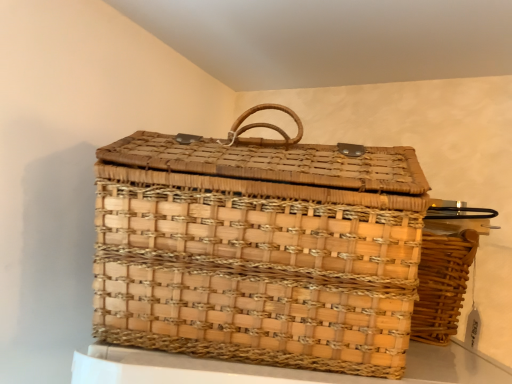
Question: From the image's perspective, is natural woven picnic basket at right, acting as the 1th picnic basket starting from the right, located above or below natural woven picnic basket at center, which appears as the 2th picnic basket when viewed from the right?

Choices:
 (A) above
 (B) below

Answer: (B)

Question: Considering their positions, is natural woven picnic basket at right, acting as the 1th picnic basket starting from the right, located in front of or behind natural woven picnic basket at center, which appears as the 2th picnic basket when viewed from the right?

Choices:
 (A) front
 (B) behind

Answer: (B)

Question: Considering the positions of natural woven picnic basket at right, acting as the 1th picnic basket starting from the right, and natural woven picnic basket at center, which ranks as the 1th picnic basket in left-to-right order, in the image, is natural woven picnic basket at right, acting as the 1th picnic basket starting from the right, taller or shorter than natural woven picnic basket at center, which ranks as the 1th picnic basket in left-to-right order,?

Choices:
 (A) tall
 (B) short

Answer: (B)

Question: From a real-world perspective, is natural woven picnic basket at center, which ranks as the 1th picnic basket in left-to-right order, physically located above or below natural woven picnic basket at right, which appears as the 2th picnic basket when viewed from the left?

Choices:
 (A) above
 (B) below

Answer: (A)

Question: From the image's perspective, is natural woven picnic basket at center, which ranks as the 1th picnic basket in left-to-right order, located above or below natural woven picnic basket at right, which appears as the 2th picnic basket when viewed from the left?

Choices:
 (A) above
 (B) below

Answer: (A)

Question: Based on their sizes in the image, would you say natural woven picnic basket at center, which ranks as the 1th picnic basket in left-to-right order, is bigger or smaller than natural woven picnic basket at right, which appears as the 2th picnic basket when viewed from the left?

Choices:
 (A) small
 (B) big

Answer: (B)

Question: Considering the positions of point (220, 274) and point (423, 278), is point (220, 274) closer or farther from the camera than point (423, 278)?

Choices:
 (A) farther
 (B) closer

Answer: (B)